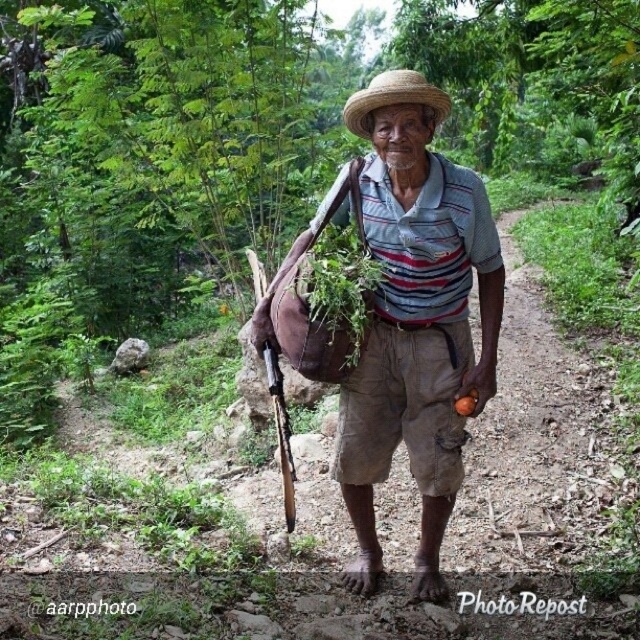
A drone is flying at a height of 4 meters above the ground. It wants to capture a photo of the point located at coordinate point [364,371]. Will the drone be able to take a clear photo of that point without any obstruction?

The drone is flying at 4 meters, and the objects are 3.91 meters apart. Since the drone is only 0.09 meters higher than the distance between the objects, it might still be obstructed depending on the terrain. However, without specific information about obstacles between the drone and the point, it is uncertain. The answer cannot be definitively determined with the given information.